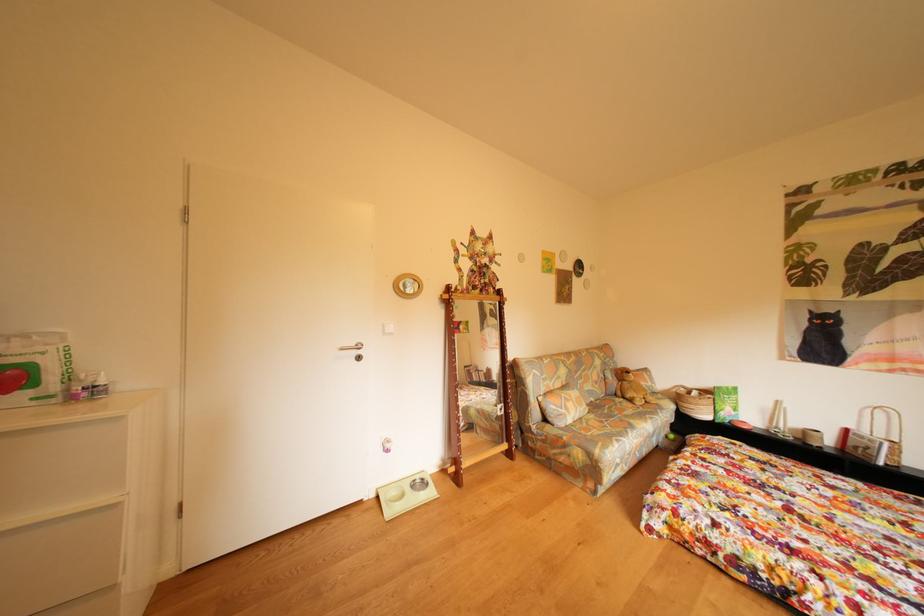
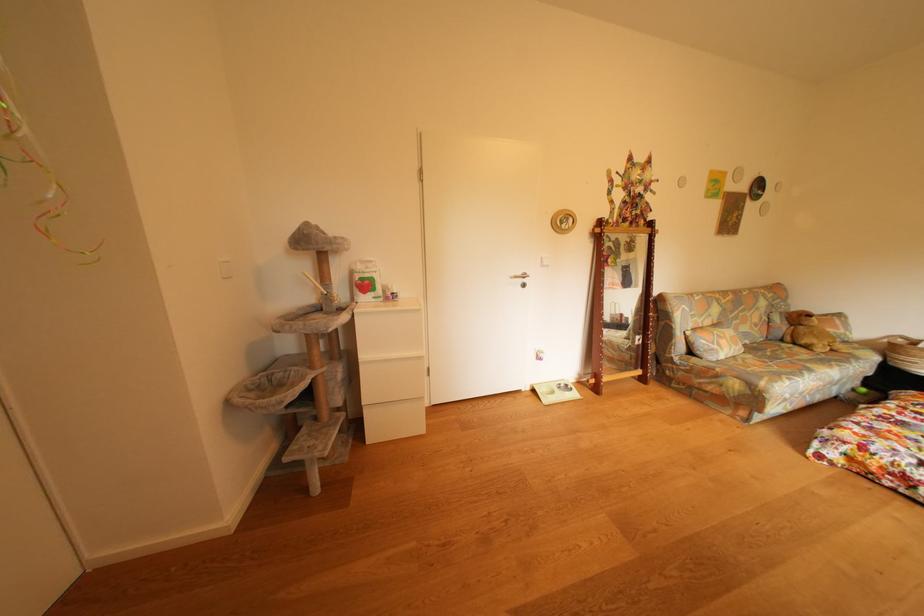
Question: The images are taken continuously from a first-person perspective. In which direction is your viewpoint rotating?

Choices:
 (A) Left
 (B) Right
 (C) Up
 (D) Down

Answer: (A)